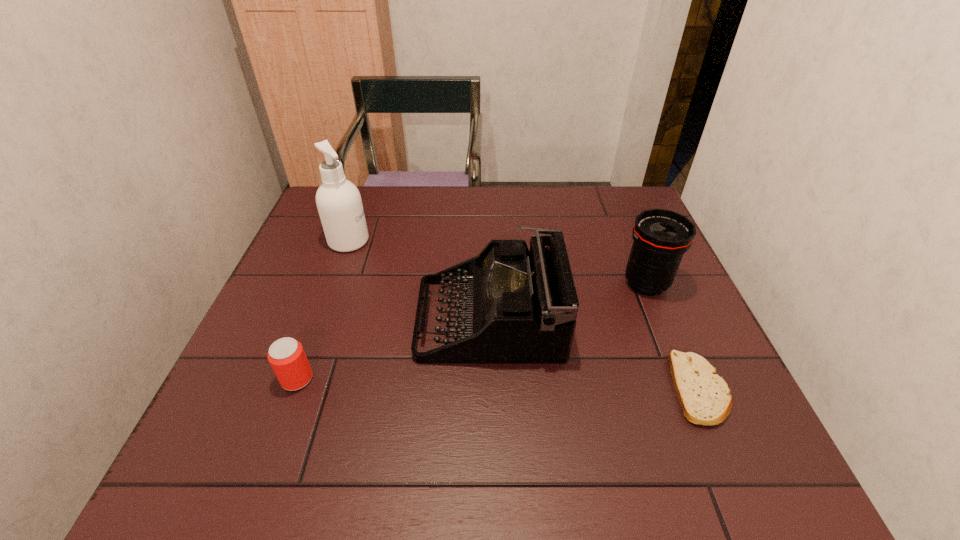
The image size is (960, 540). I want to click on free space located 0.300m on the typing side of the third object from right to left, so click(x=292, y=318).

You are a GUI agent. You are given a task and a screenshot of the screen. Output one action in this format:
    pyautogui.click(x=<x>, y=<y>)
    Task: Click on the free point located 0.300m on the back of the beer can
    
    Given the screenshot: What is the action you would take?
    pyautogui.click(x=336, y=273)

Where is `blank space located 0.290m on the back of the shortest object`? Image resolution: width=960 pixels, height=540 pixels. blank space located 0.290m on the back of the shortest object is located at coordinates (648, 268).

Locate an element on the screen. The width and height of the screenshot is (960, 540). cleansing agent that is positioned at the left edge is located at coordinates (339, 204).

I want to click on beer can present at the left edge, so click(286, 356).

Find the location of `telephoto lens that is at the right edge`. telephoto lens that is at the right edge is located at coordinates (661, 237).

What are the coordinates of `pita bread located at the right edge` in the screenshot? It's located at (704, 396).

Locate an element on the screen. This screenshot has height=540, width=960. vacant space at the far edge of the desktop is located at coordinates (584, 198).

Image resolution: width=960 pixels, height=540 pixels. What are the coordinates of `vacant space at the near edge of the desktop` in the screenshot? It's located at (380, 455).

In order to click on vacant space at the left edge of the desktop in this screenshot , I will do `click(313, 315)`.